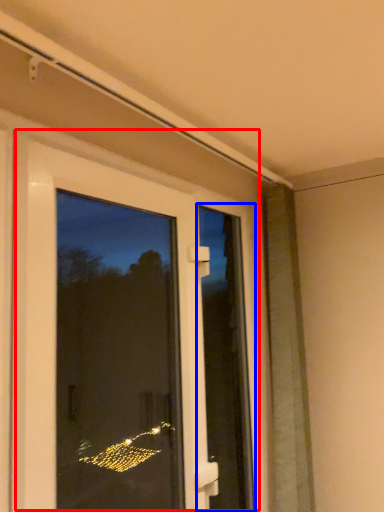
Question: Which of the following is the farthest to the observer, door (highlighted by a red box) or screen door (highlighted by a blue box)?

Choices:
 (A) door
 (B) screen door

Answer: (B)